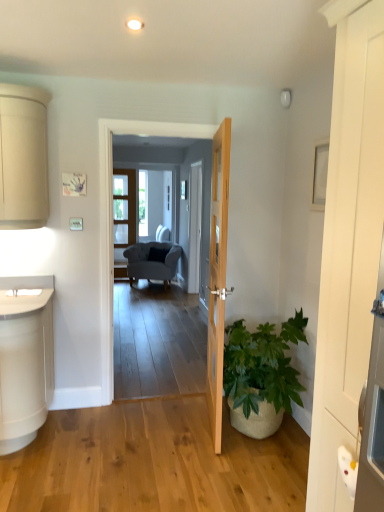
Question: Is green leafy plant in woven basket at lower right taller than natural wood door at center, positioned as the second door in right-to-left order?

Choices:
 (A) yes
 (B) no

Answer: (B)

Question: Is green leafy plant in woven basket at lower right positioned behind natural wood door at center, positioned as the second door in right-to-left order?

Choices:
 (A) yes
 (B) no

Answer: (A)

Question: From the image's perspective, is green leafy plant in woven basket at lower right on natural wood door at center, which ranks as the first door in back-to-front order?

Choices:
 (A) no
 (B) yes

Answer: (A)

Question: Is green leafy plant in woven basket at lower right closer to the viewer compared to natural wood door at center, which ranks as the first door in back-to-front order?

Choices:
 (A) yes
 (B) no

Answer: (B)

Question: From a real-world perspective, does green leafy plant in woven basket at lower right stand above natural wood door at center, which is the second door from front to back?

Choices:
 (A) no
 (B) yes

Answer: (A)

Question: Considering the positions of suede gray armchair at center and smooth gray carpet at center in the image, is suede gray armchair at center taller or shorter than smooth gray carpet at center?

Choices:
 (A) short
 (B) tall

Answer: (A)

Question: In the image, is suede gray armchair at center on the left side or the right side of smooth gray carpet at center?

Choices:
 (A) left
 (B) right

Answer: (A)

Question: Is suede gray armchair at center in front of or behind smooth gray carpet at center in the image?

Choices:
 (A) front
 (B) behind

Answer: (B)

Question: In terms of size, does suede gray armchair at center appear bigger or smaller than smooth gray carpet at center?

Choices:
 (A) big
 (B) small

Answer: (A)

Question: From a real-world perspective, is smooth gray carpet at center physically located above or below white wooden door at right, the 1th door in the right-to-left sequence?

Choices:
 (A) above
 (B) below

Answer: (B)

Question: Considering the positions of smooth gray carpet at center and white wooden door at right, the second door viewed from the left, in the image, is smooth gray carpet at center wider or thinner than white wooden door at right, the second door viewed from the left,?

Choices:
 (A) wide
 (B) thin

Answer: (A)

Question: From the image's perspective, is smooth gray carpet at center above or below white wooden door at right, placed as the 2th door when sorted from back to front?

Choices:
 (A) above
 (B) below

Answer: (A)

Question: Visually, is smooth gray carpet at center positioned to the left or to the right of white wooden door at right, which appears as the 1th door when viewed from the front?

Choices:
 (A) right
 (B) left

Answer: (B)

Question: From the image's perspective, relative to clear glass screen door at center, is smooth gray carpet at center above or below?

Choices:
 (A) above
 (B) below

Answer: (B)

Question: Is smooth gray carpet at center in front of or behind clear glass screen door at center in the image?

Choices:
 (A) front
 (B) behind

Answer: (A)